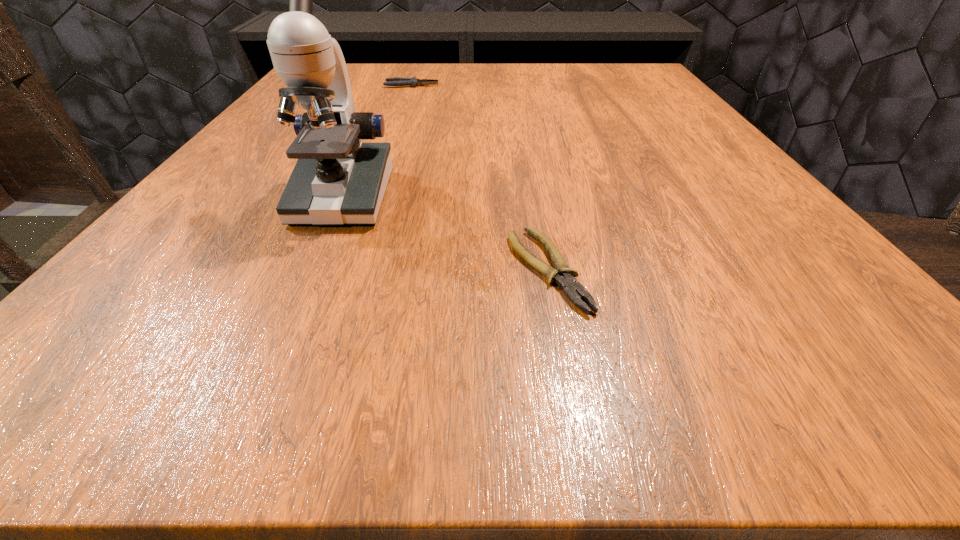
Locate an element on the screen. The width and height of the screenshot is (960, 540). the second nearest object is located at coordinates (337, 180).

Where is `the tallest object`? The image size is (960, 540). the tallest object is located at coordinates (337, 180).

You are a GUI agent. You are given a task and a screenshot of the screen. Output one action in this format:
    pyautogui.click(x=<x>, y=<y>)
    Task: Click on the taller pliers
    
    Given the screenshot: What is the action you would take?
    pyautogui.click(x=396, y=81)

At what (x,y) coordinates should I click in order to perform the action: click on the left pliers. Please return your answer as a coordinate pair (x, y). This screenshot has height=540, width=960. Looking at the image, I should click on (396, 81).

Identify the location of the nearest object. (563, 276).

Where is `the rightmost object`? the rightmost object is located at coordinates (563, 276).

At what (x,y) coordinates should I click in order to perform the action: click on free space located 0.160m at the eyepiece of the tallest object. Please return your answer as a coordinate pair (x, y). The width and height of the screenshot is (960, 540). Looking at the image, I should click on (289, 315).

You are a GUI agent. You are given a task and a screenshot of the screen. Output one action in this format:
    pyautogui.click(x=<x>, y=<y>)
    Task: Click on the vacant space located at the gripping part of the left pliers
    Image resolution: width=960 pixels, height=540 pixels.
    Given the screenshot: What is the action you would take?
    pyautogui.click(x=477, y=85)

Identify the location of free space located 0.250m on the left of the shorter pliers. (300, 269).

Where is `object situated at the far edge`? Image resolution: width=960 pixels, height=540 pixels. object situated at the far edge is located at coordinates (396, 81).